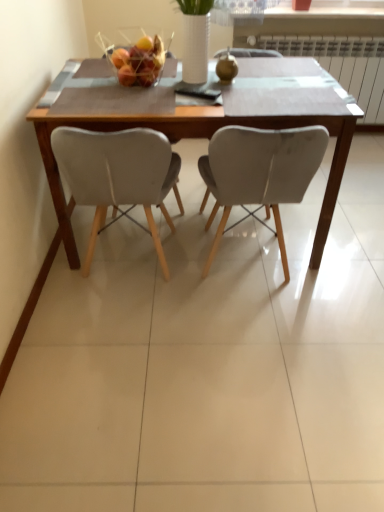
Question: Is wooden table at center positioned far away from matte gray chair at center, marked as the 2th chair in a left-to-right arrangement?

Choices:
 (A) yes
 (B) no

Answer: (B)

Question: Could you tell me if wooden table at center is facing matte gray chair at center, marked as the 2th chair in a left-to-right arrangement?

Choices:
 (A) yes
 (B) no

Answer: (B)

Question: Is wooden table at center behind matte gray chair at center, which is the 1th chair from right to left?

Choices:
 (A) no
 (B) yes

Answer: (B)

Question: Would you say wooden table at center is outside matte gray chair at center, marked as the 2th chair in a left-to-right arrangement?

Choices:
 (A) no
 (B) yes

Answer: (B)

Question: Can you confirm if wooden table at center is thinner than matte gray chair at center, which is the 1th chair from right to left?

Choices:
 (A) no
 (B) yes

Answer: (A)

Question: Visually, is wooden table at center positioned to the left or to the right of metallic wire basket at center?

Choices:
 (A) right
 (B) left

Answer: (A)

Question: Is wooden table at center wider or thinner than metallic wire basket at center?

Choices:
 (A) thin
 (B) wide

Answer: (B)

Question: From their relative heights in the image, would you say wooden table at center is taller or shorter than metallic wire basket at center?

Choices:
 (A) tall
 (B) short

Answer: (A)

Question: In terms of size, does wooden table at center appear bigger or smaller than metallic wire basket at center?

Choices:
 (A) small
 (B) big

Answer: (B)

Question: In terms of height, does wooden table at center look taller or shorter compared to white plastic radiator at upper right?

Choices:
 (A) tall
 (B) short

Answer: (A)

Question: Is wooden table at center wider or thinner than white plastic radiator at upper right?

Choices:
 (A) wide
 (B) thin

Answer: (A)

Question: Considering their positions, is wooden table at center located in front of or behind white plastic radiator at upper right?

Choices:
 (A) behind
 (B) front

Answer: (B)

Question: Is point (354, 121) closer or farther from the camera than point (367, 116)?

Choices:
 (A) farther
 (B) closer

Answer: (B)

Question: From the image's perspective, relative to matte gray chair at center, marked as the 2th chair in a left-to-right arrangement, is wooden table at center above or below?

Choices:
 (A) below
 (B) above

Answer: (B)

Question: Is wooden table at center bigger or smaller than matte gray chair at center, marked as the 2th chair in a left-to-right arrangement?

Choices:
 (A) small
 (B) big

Answer: (B)